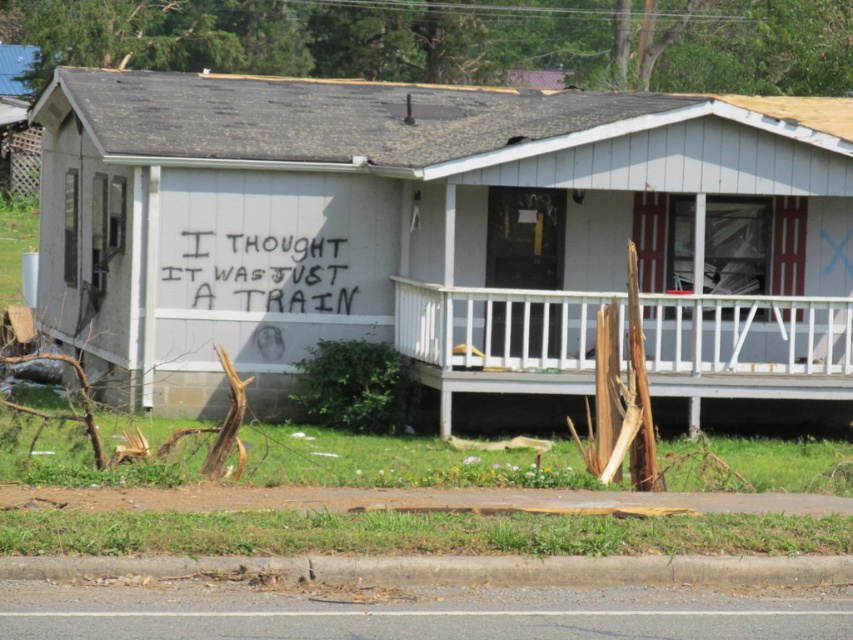
You are standing in front of the house and want to locate the white wooden porch at lower center. According to the coordinates provided, where would you find it?

The white wooden porch at lower center is located at the coordinates point (500, 339).

You are a delivery person approaching the house and need to reach the front door. The white wooden porch at lower center and the black spray paint graffiti at center are in your path. Which object will you encounter first?

The white wooden porch at lower center is in front of the black spray paint graffiti at center, so you will encounter the white wooden porch at lower center first before reaching the black spray paint graffiti at center.

You are a delivery person approaching the house and need to park your vehicle. The white wooden porch at lower center and the black spray paint graffiti at center are both visible from the road. Which of these two features is bigger in size?

The white wooden porch at lower center has a larger size compared to the black spray paint graffiti at center, so the white wooden porch at lower center is bigger in size.